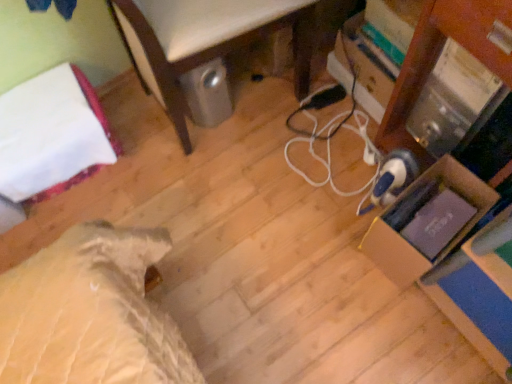
I want to click on vacant area to the left of cardboard box at right, so pos(340,264).